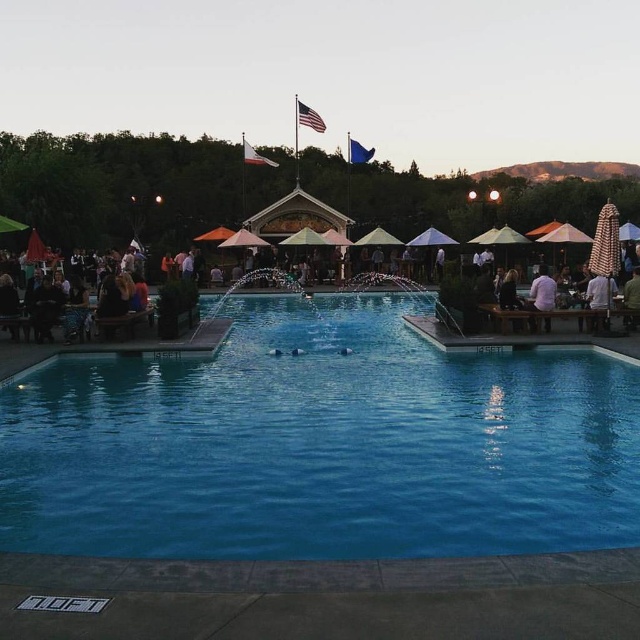
You are planning to host a small gathering and need to know which area has more space for guests. Based on the image, which object takes up more space, the blue smooth pool at center or the matte wooden tables at lower left?

The matte wooden tables at lower left occupy more space than the blue smooth pool at center according to the description.

You are standing at the edge of the blue smooth pool at center. A friend is at point (321,444). Can you see your friend in the water?

Yes, the point (321,444) is on the blue smooth pool at center, so your friend is in the water and visible.